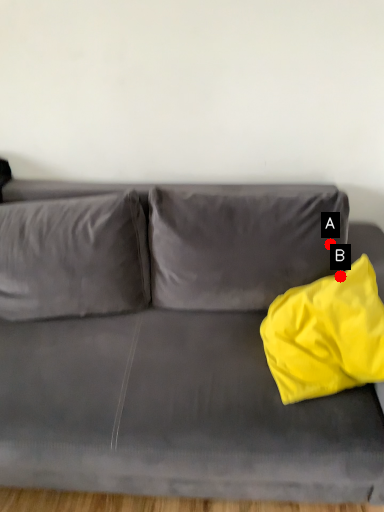
Question: Two points are circled on the image, labeled by A and B beside each circle. Among these points, which one is farthest from the camera?

Choices:
 (A) A is further
 (B) B is further

Answer: (A)